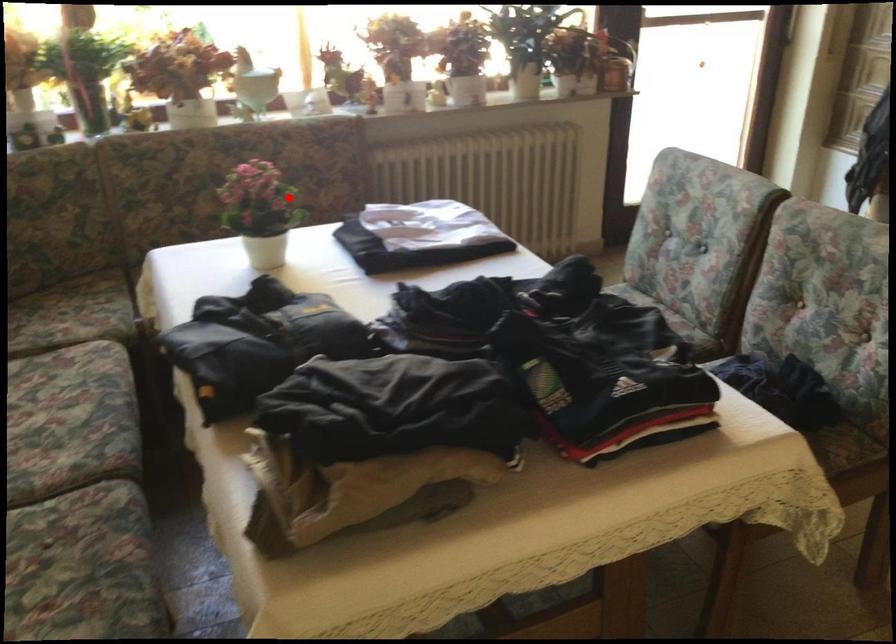
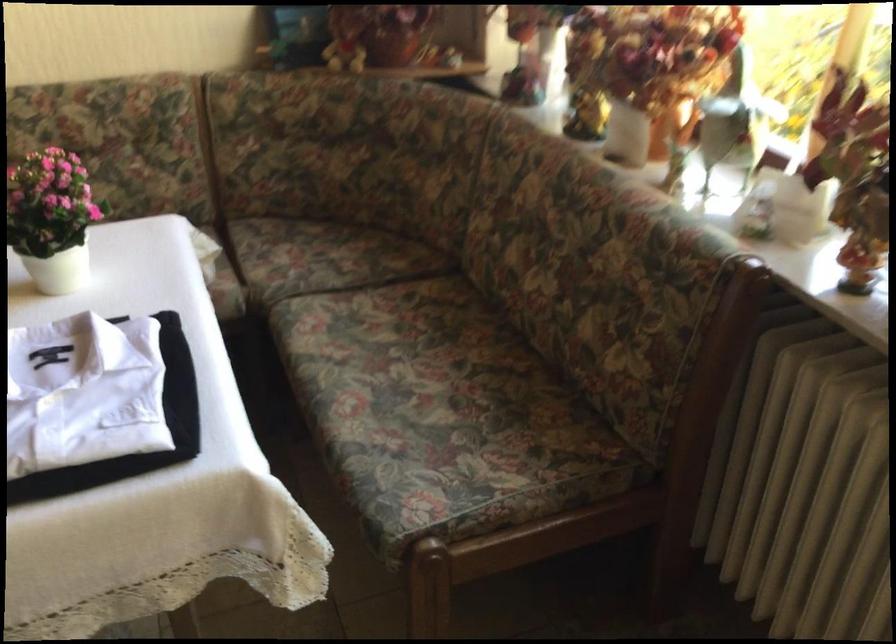
Question: I am providing you with two images of the same scene from different viewpoints. In image1, a red point is highlighted. Considering the same 3D point in image2, which of the following is correct?

Choices:
 (A) It is closer
 (B) It is farther

Answer: (A)